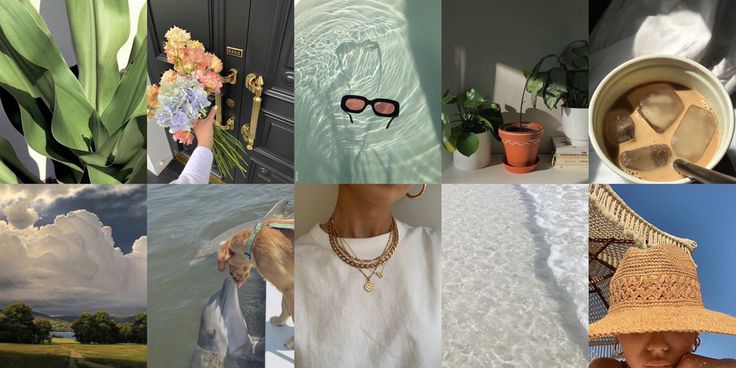
Locate an element on the screen. This screenshot has height=368, width=736. photos in collage is located at coordinates (657, 87), (662, 237), (519, 248), (520, 63), (400, 71), (227, 76), (106, 79), (124, 265), (224, 264), (371, 281).